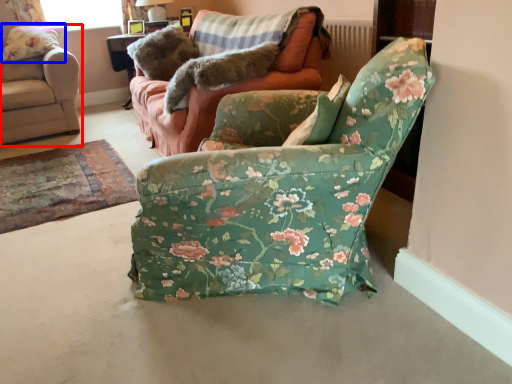
Question: Among these objects, which one is farthest to the camera, chair (highlighted by a red box) or pillow (highlighted by a blue box)?

Choices:
 (A) chair
 (B) pillow

Answer: (B)